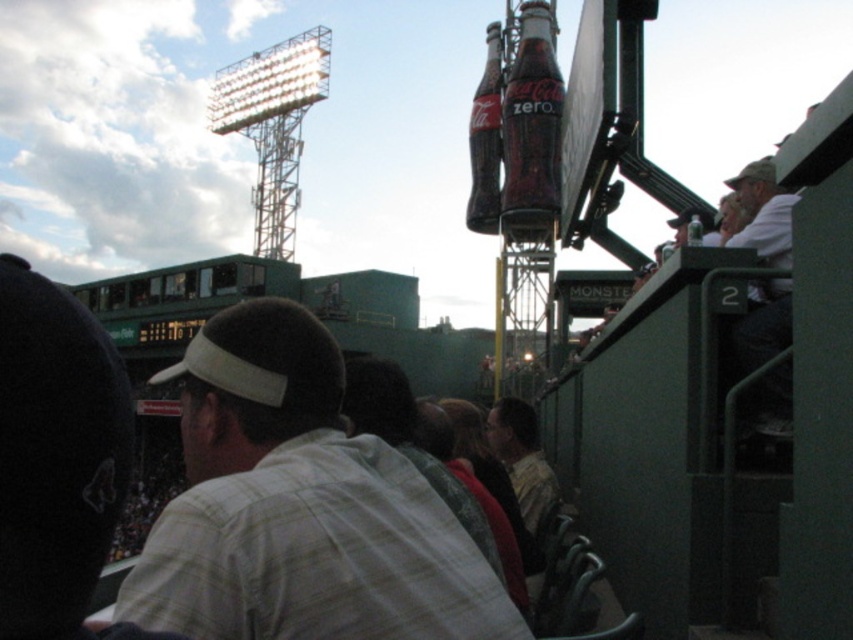
Looking at this image, you are a photographer standing at the edge of the baseball stadium field. You want to take a photo of both the white plaid shirt at center and the white cotton shirt at right. The minimum distance your camera can focus on two objects is 100 feet. Can you capture both shirts in sharp focus?

The white plaid shirt at center is 138.55 feet away from the white cotton shirt at right. Since the distance between them is greater than 100 feet, your camera can focus on both shirts in sharp focus.

Based on the photo, you are a photographer trying to capture a candid shot of the white cotton shirt at right and the clear glass bottle at upper right in the same frame. Considering their sizes, which object will appear larger in your photo?

The white cotton shirt at right will appear larger in the photo because its width is greater than that of the clear glass bottle at upper right.

You are a photographer at the baseball stadium and want to take a photo of the white plaid shirt at center and the white cotton shirt at right. Which shirt should you focus on first if you want to capture both in the frame without moving the camera?

The white plaid shirt at center is to the left of the white cotton shirt at right, so you should focus on the white plaid shirt at center first to ensure both are in frame without moving the camera.